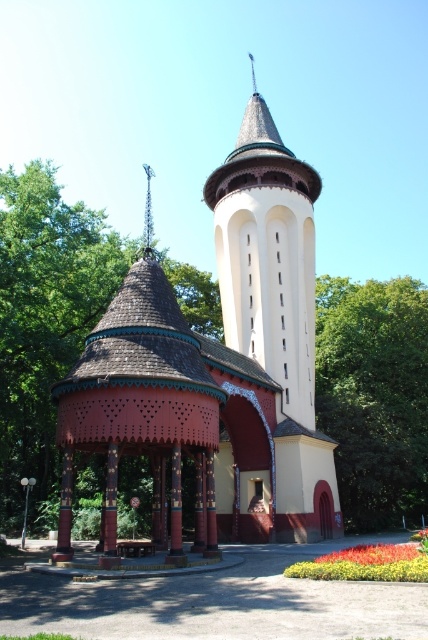
Is brown wooden gazebo at left smaller than white smooth tower at center?

No, brown wooden gazebo at left is not smaller than white smooth tower at center.

Which of these two, brown wooden gazebo at left or white smooth tower at center, stands taller?

white smooth tower at center

Is point (67, 209) closer to camera compared to point (294, 321)?

Yes, it is.

Locate an element on the screen. The width and height of the screenshot is (428, 640). brown wooden gazebo at left is located at coordinates (44, 324).

Is brown wooden gazebo at left wider than green leafy tree at upper center?

Correct, the width of brown wooden gazebo at left exceeds that of green leafy tree at upper center.

Between point (24, 394) and point (365, 452), which one is positioned behind?

The point (365, 452) is behind.

Is point (95, 273) positioned in front of point (344, 384)?

That is True.

At what (x,y) coordinates should I click in order to perform the action: click on brown wooden gazebo at left. Please return your answer as a coordinate pair (x, y). Image resolution: width=428 pixels, height=640 pixels. Looking at the image, I should click on (44, 324).

Is green leafy tree at upper center below white smooth tower at center?

Yes, green leafy tree at upper center is below white smooth tower at center.

Between green leafy tree at upper center and white smooth tower at center, which one has more height?

white smooth tower at center is taller.

You are a GUI agent. You are given a task and a screenshot of the screen. Output one action in this format:
    pyautogui.click(x=<x>, y=<y>)
    Task: Click on the green leafy tree at upper center
    The width and height of the screenshot is (428, 640).
    Given the screenshot: What is the action you would take?
    pyautogui.click(x=374, y=396)